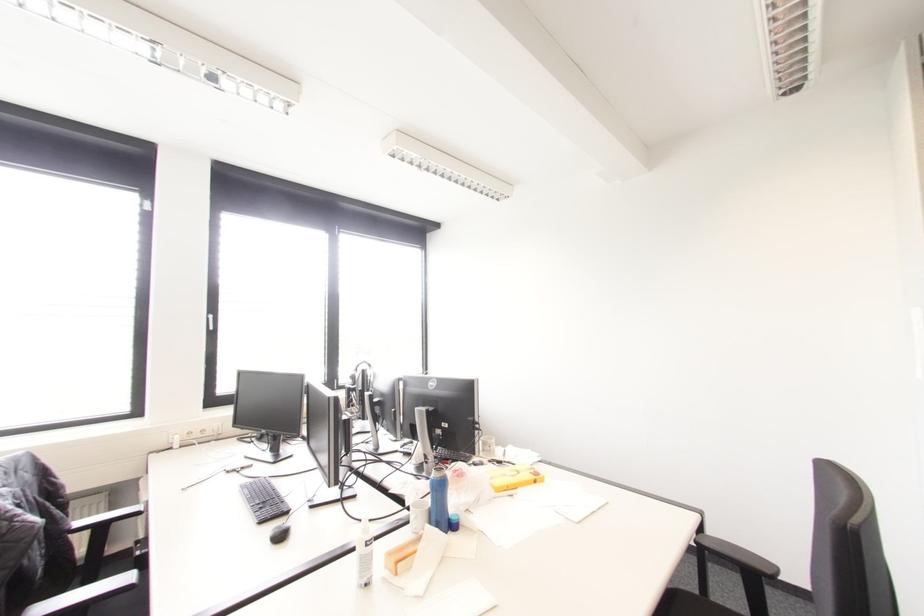
Image resolution: width=924 pixels, height=616 pixels. In order to click on white window handle in this screenshot , I will do `click(210, 322)`.